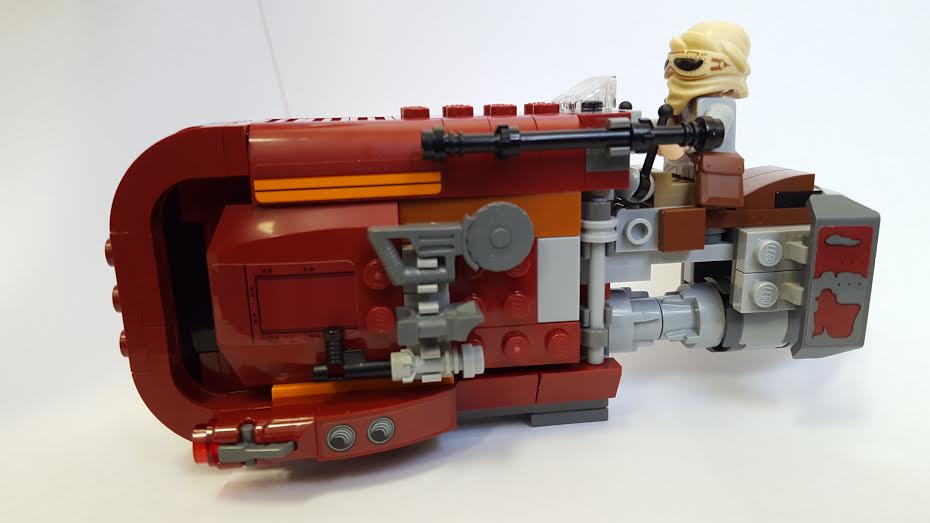
This screenshot has height=523, width=930. What are the coordinates of `wall` in the screenshot? It's located at (827, 104).